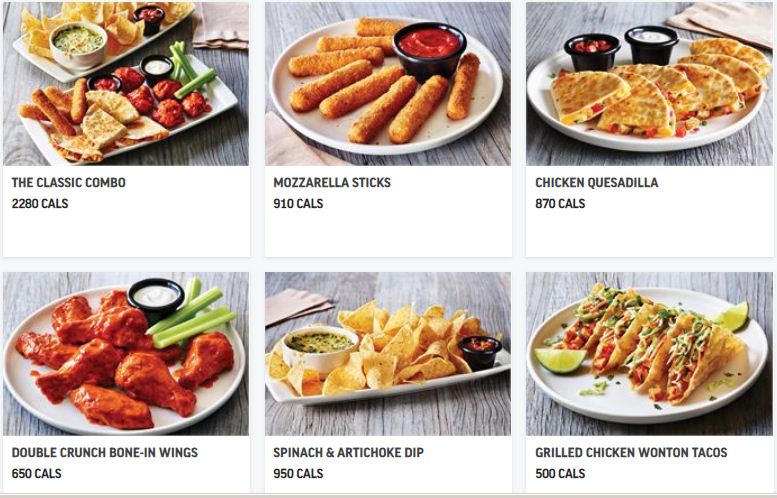
This screenshot has height=498, width=777. In order to click on circle plate in this screenshot , I will do `click(23, 390)`, `click(437, 129)`, `click(600, 137)`, `click(624, 405)`.